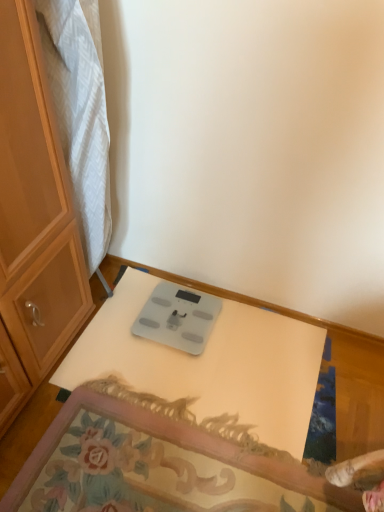
Identify the location of free space to the right of silver metallic scale at center. This screenshot has height=512, width=384. (250, 336).